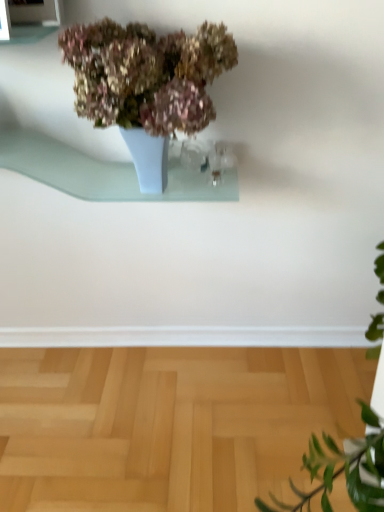
Question: Is light blue glass shelf at upper center spatially inside matte ceramic vase at upper center, or outside of it?

Choices:
 (A) outside
 (B) inside

Answer: (B)

Question: In terms of height, does light blue glass shelf at upper center look taller or shorter compared to matte ceramic vase at upper center?

Choices:
 (A) tall
 (B) short

Answer: (B)

Question: Based on their relative distances, which object is farther from the matte ceramic vase at upper center?

Choices:
 (A) light wood parquet floor at lower center
 (B) light blue glass shelf at upper center

Answer: (A)

Question: Estimate the real-world distances between objects in this image. Which object is farther from the light blue glass shelf at upper center?

Choices:
 (A) light wood parquet floor at lower center
 (B) matte ceramic vase at upper center

Answer: (A)